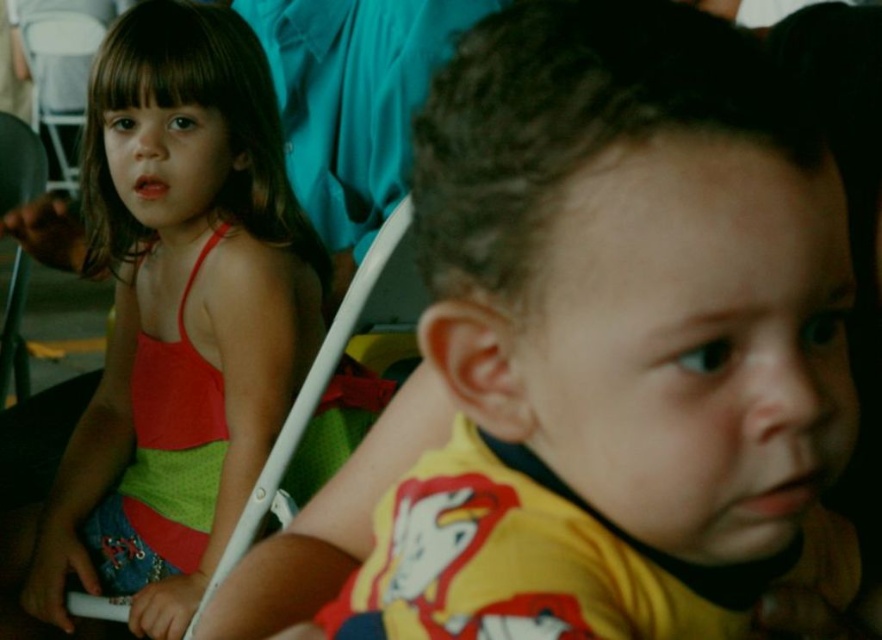
You are a photographer trying to focus on the matte red tank top at left. What are the coordinates of this object in the image?

The matte red tank top at left is located at point [184,284].

You are a photographer trying to capture a clear shot of the two children. There is a point marked at coordinates (184, 284). What object is located at this point?

The object at point (184, 284) is the matte red tank top at left.